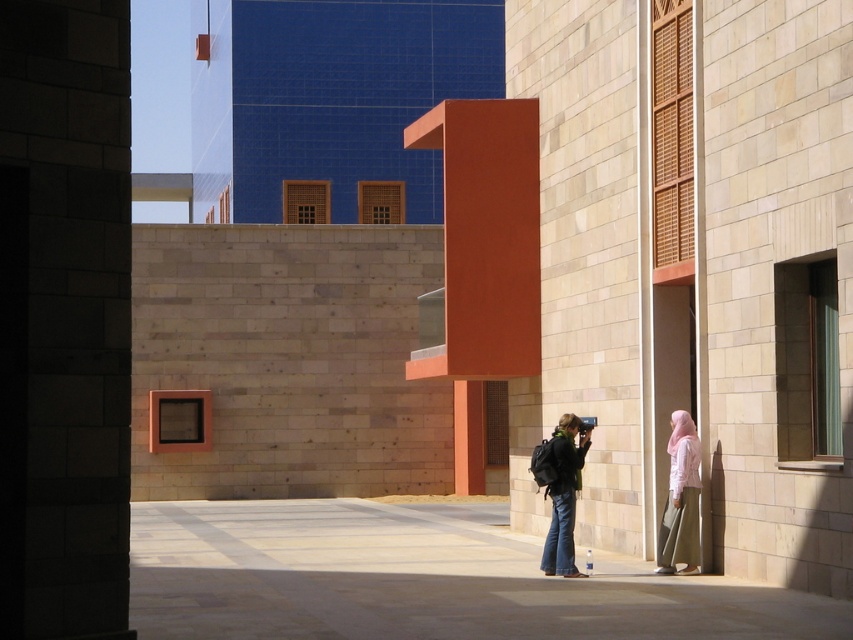
Between point (427, 358) and point (563, 513), which one is positioned behind?

The point (427, 358) is more distant.

Who is shorter, matte orange pillar at center or denim jeans at center?

Standing shorter between the two is denim jeans at center.

What are the coordinates of `matte orange pillar at center` in the screenshot? It's located at (483, 259).

Between point (683, 547) and point (560, 454), which one is positioned in front?

Point (683, 547) is more forward.

Can you confirm if pale pink fabric hijab at lower right is bigger than denim jeans at center?

No.

The height and width of the screenshot is (640, 853). What do you see at coordinates (680, 499) in the screenshot?
I see `pale pink fabric hijab at lower right` at bounding box center [680, 499].

The image size is (853, 640). In order to click on pale pink fabric hijab at lower right in this screenshot , I will do `click(680, 499)`.

Can you confirm if matte orange pillar at center is bigger than pale pink fabric hijab at lower right?

Indeed, matte orange pillar at center has a larger size compared to pale pink fabric hijab at lower right.

Who is more forward, (x=468, y=253) or (x=688, y=472)?

Positioned in front is point (x=688, y=472).

Where is `matte orange pillar at center`? This screenshot has width=853, height=640. matte orange pillar at center is located at coordinates (483, 259).